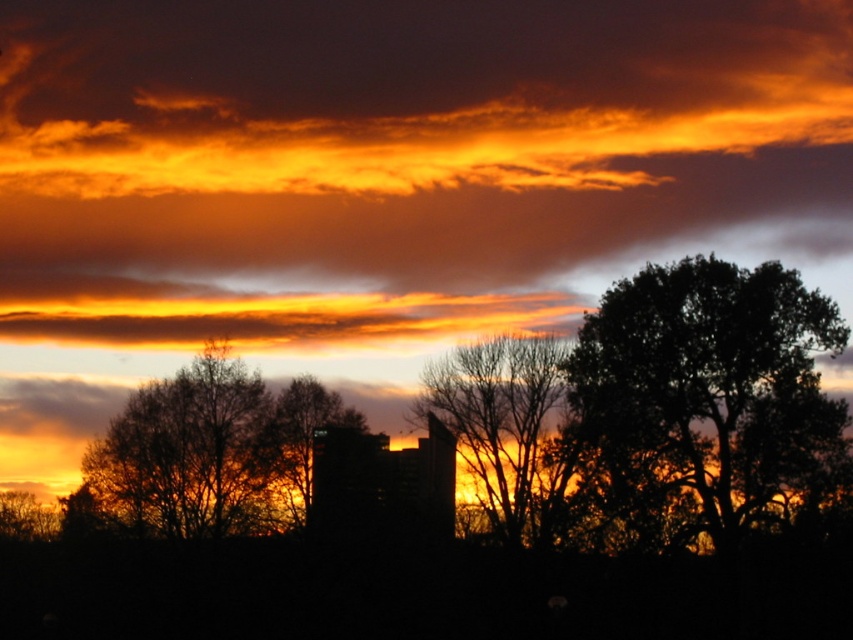
Between bare branches at center and silhouette leafy tree at center, which one appears on the right side from the viewer's perspective?

Positioned to the right is bare branches at center.

Which is below, bare branches at center or silhouette leafy tree at center?

silhouette leafy tree at center is lower down.

Is point (531, 506) closer to camera compared to point (306, 472)?

Yes, point (531, 506) is in front of point (306, 472).

Locate an element on the screen. This screenshot has width=853, height=640. bare branches at center is located at coordinates tap(506, 426).

The width and height of the screenshot is (853, 640). What do you see at coordinates (709, 392) in the screenshot?
I see `dark green leafy tree at right` at bounding box center [709, 392].

Is dark green leafy tree at right wider than silhouette leafy tree at center?

Yes.

What do you see at coordinates (709, 392) in the screenshot?
I see `dark green leafy tree at right` at bounding box center [709, 392].

The width and height of the screenshot is (853, 640). Identify the location of dark green leafy tree at right. (709, 392).

Is brown textured tree at center positioned behind bare branches at center?

Yes, it is behind bare branches at center.

Which is in front, point (183, 484) or point (556, 349)?

Point (556, 349) is in front.

Image resolution: width=853 pixels, height=640 pixels. I want to click on brown textured tree at center, so click(x=186, y=451).